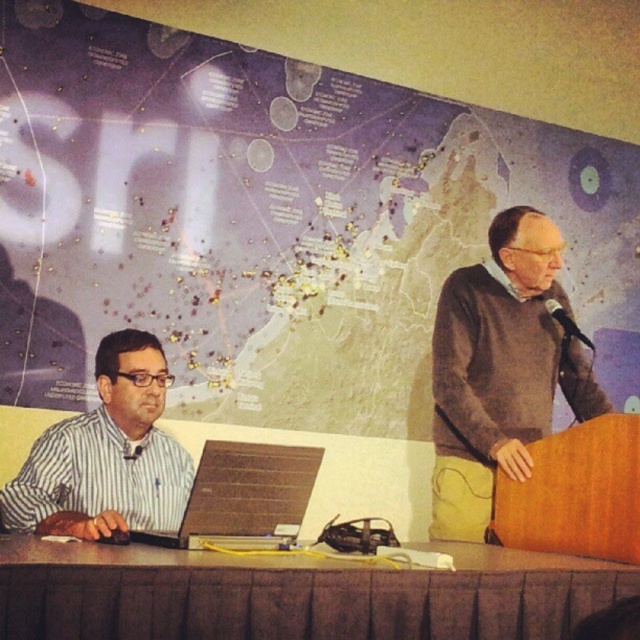
You are a technician who needs to connect the matte black laptop at left to the black plastic microphone at upper right using a 4 feet long cable. Can you do it?

The distance between the matte black laptop at left and the black plastic microphone at upper right is 4.17 feet, which is slightly longer than the 4 feet cable available. Therefore, the cable might be too short to reach.

You are a photographer trying to capture a candid shot of the striped fabric shirt at left without including the brown fabric table at lower center in the frame. Is this possible given their positions?

The brown fabric table at lower center is positioned under the striped fabric shirt at left, so it might be challenging to capture the shirt without including the table in the frame since the table is directly beneath it.